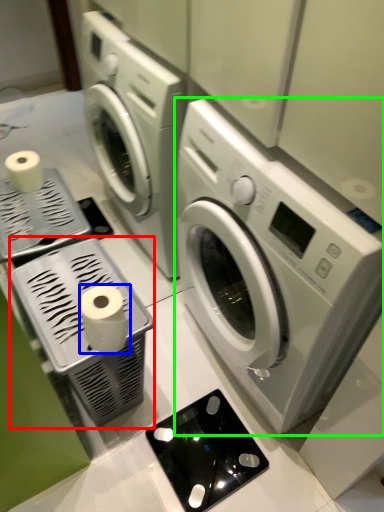
Question: Based on their relative distances, which object is farther from appliance (highlighted by a red box)? Choose from toilet paper (highlighted by a blue box) and washing machine (highlighted by a green box).

Choices:
 (A) toilet paper
 (B) washing machine

Answer: (B)